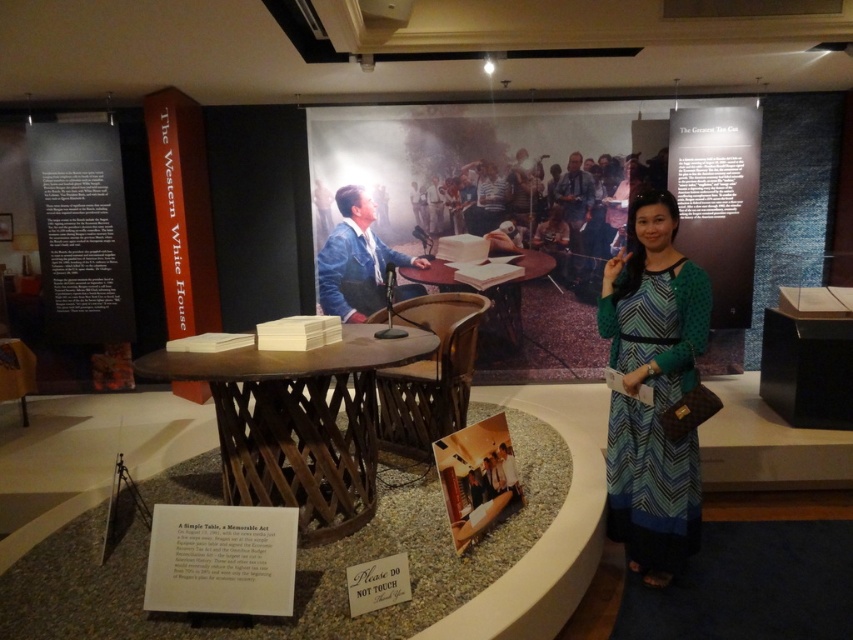
Is point (155, 362) behind point (434, 186)?

That is False.

Identify the location of wooden round table at center. (297, 422).

Is green zigzag dress at center to the right of matte blue shirt at center from the viewer's perspective?

No, green zigzag dress at center is not to the right of matte blue shirt at center.

Consider the image. Is green zigzag dress at center thinner than matte blue shirt at center?

Incorrect, green zigzag dress at center's width is not less than matte blue shirt at center's.

Where is `green zigzag dress at center`? This screenshot has width=853, height=640. green zigzag dress at center is located at coordinates (653, 388).

This screenshot has width=853, height=640. I want to click on green zigzag dress at center, so click(653, 388).

Who is shorter, matte blue shirt at center or light brown wood table at center?

light brown wood table at center

Between point (577, 234) and point (428, 182), which one is positioned behind?

Point (577, 234)

Measure the distance between matte blue shirt at center and camera.

matte blue shirt at center is 5.44 meters from camera.

Find the location of `matte blue shirt at center`. matte blue shirt at center is located at coordinates (573, 212).